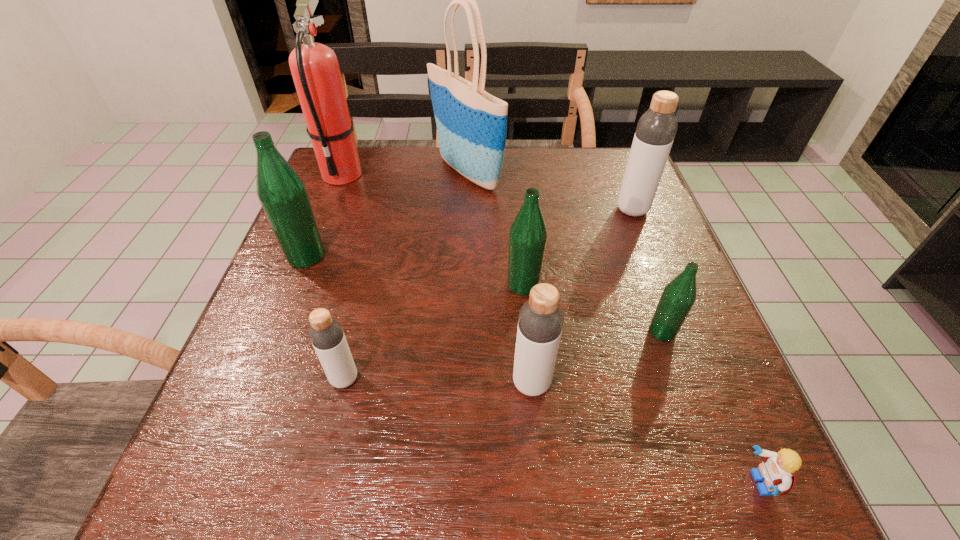
Where is `the leftmost gray bottle`? The width and height of the screenshot is (960, 540). the leftmost gray bottle is located at coordinates (326, 334).

Locate an element on the screen. This screenshot has height=540, width=960. the sixth farthest object is located at coordinates (678, 297).

At what (x,y) coordinates should I click in order to perform the action: click on the third nearest bottle. Please return your answer as a coordinate pair (x, y). This screenshot has width=960, height=540. Looking at the image, I should click on (678, 297).

Image resolution: width=960 pixels, height=540 pixels. What are the coordinates of `the nearest object` in the screenshot? It's located at (778, 470).

Image resolution: width=960 pixels, height=540 pixels. Identify the location of Lego. (778, 470).

I want to click on vacant space located on the left of the tote bag, so click(406, 173).

At what (x,y) coordinates should I click in order to perform the action: click on vacant position located on the hose direction of the fire extinguisher. Please return your answer as a coordinate pair (x, y). This screenshot has width=960, height=540. Looking at the image, I should click on (317, 239).

I want to click on vacant space located 0.310m on the front of the farthest bottle, so click(x=674, y=318).

Locate an element on the screen. Image resolution: width=960 pixels, height=540 pixels. free location located 0.400m on the front of the biggest green bottle is located at coordinates (229, 449).

Identify the location of free location located on the front of the second nearest green bottle. (529, 345).